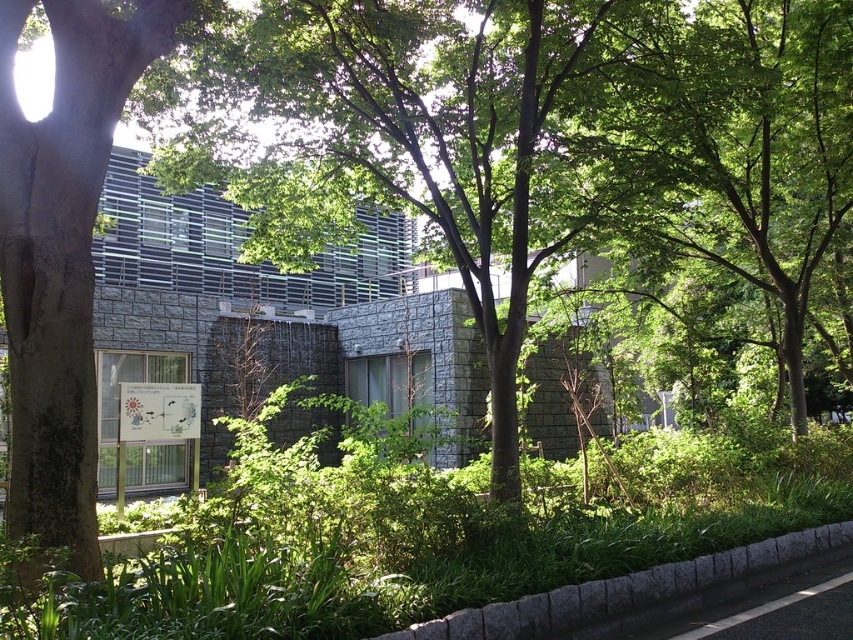
You are standing at the entrance of the modern building and want to locate two specific points marked in the image. The first point is at coordinates point (436, 179) and the second is at point (454, 625). Which point is closer to you when viewed from the entrance?

Point (454, 625) is closer to you because it is in front of point (436, 179).

You are standing at point (64, 252) in the image. What do you see directly in front of you?

You see a green leafy tree at left directly in front of you.